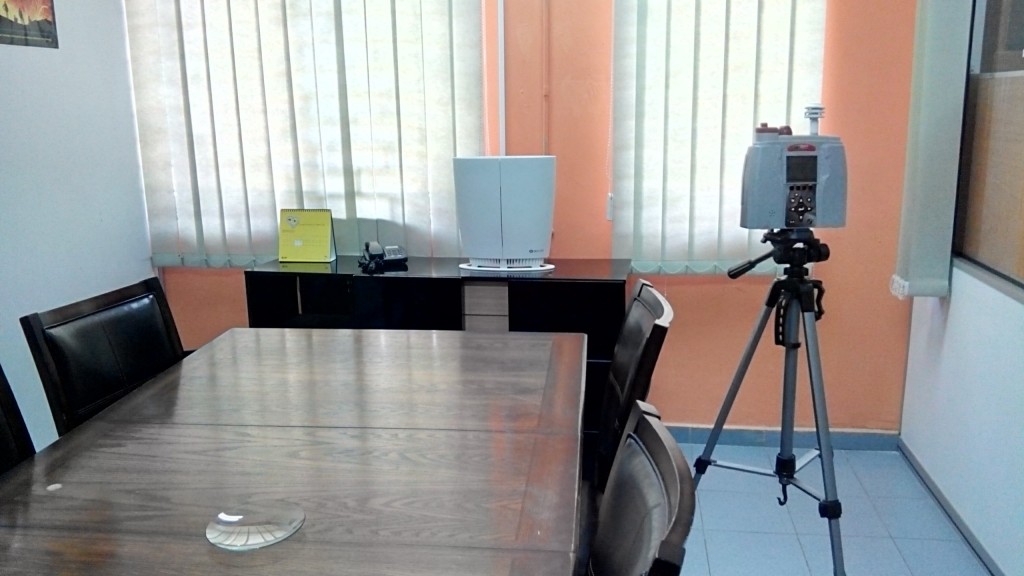
I want to click on place to sit down, so click(111, 363).